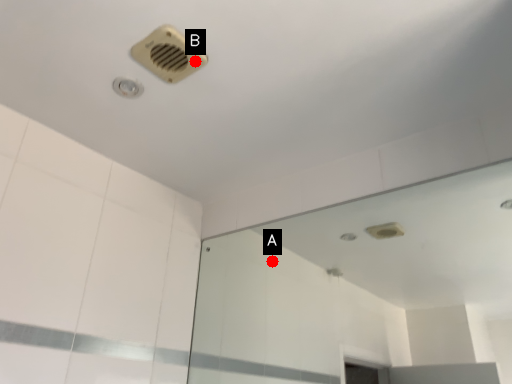
Question: Two points are circled on the image, labeled by A and B beside each circle. Among these points, which one is nearest to the camera?

Choices:
 (A) A is closer
 (B) B is closer

Answer: (B)